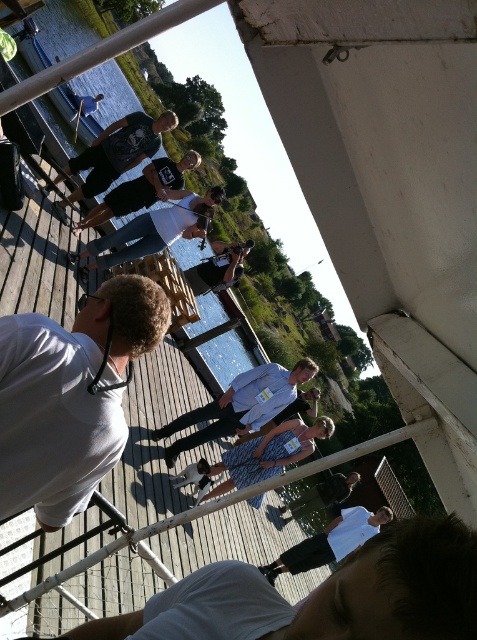
Question: Does dark gray t-shirt at center come behind matte black camera at center?

Choices:
 (A) no
 (B) yes

Answer: (A)

Question: Among these objects, which one is farthest from the camera?

Choices:
 (A) black t-shirt at center
 (B) white matte shirt at center
 (C) white matte shirt at lower center

Answer: (A)

Question: From the image, what is the correct spatial relationship of patterned fabric dress at center in relation to black t-shirt at center?

Choices:
 (A) right
 (B) left

Answer: (A)

Question: Which point is closer to the camera?

Choices:
 (A) (296, 396)
 (B) (374, 532)
 (C) (118, 141)
 (D) (194, 232)

Answer: (A)

Question: Does patterned fabric dress at center have a lesser width compared to white matte shirt at lower center?

Choices:
 (A) no
 (B) yes

Answer: (B)

Question: Which point is farther from the camera taking this photo?

Choices:
 (A) (288, 552)
 (B) (177, 193)

Answer: (A)